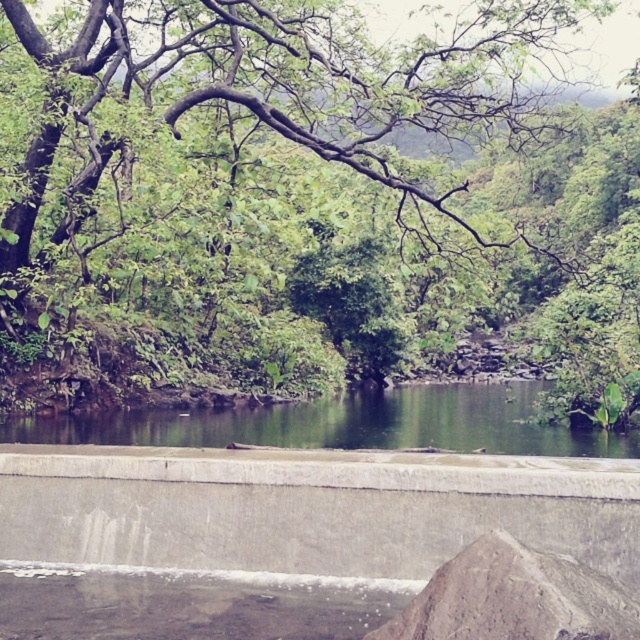
Does gray concrete at center appear under green smooth water at center?

No.

Does gray concrete at center appear on the right side of green smooth water at center?

Incorrect, gray concrete at center is not on the right side of green smooth water at center.

Where is `gray concrete at center`? gray concrete at center is located at coordinates (308, 508).

Image resolution: width=640 pixels, height=640 pixels. Find the location of `gray concrete at center`. gray concrete at center is located at coordinates (308, 508).

Is green leafy tree at upper center positioned before green smooth water at center?

Yes.

This screenshot has height=640, width=640. Find the location of `green leafy tree at upper center`. green leafy tree at upper center is located at coordinates (253, 184).

Who is more distant from viewer, (262, 145) or (100, 417)?

The point (262, 145) is more distant.

This screenshot has height=640, width=640. Find the location of `green leafy tree at upper center`. green leafy tree at upper center is located at coordinates (253, 184).

Does green leafy tree at upper center have a smaller size compared to gray concrete at center?

No, green leafy tree at upper center is not smaller than gray concrete at center.

At what (x,y) coordinates should I click in order to perform the action: click on green leafy tree at upper center. Please return your answer as a coordinate pair (x, y). The height and width of the screenshot is (640, 640). Looking at the image, I should click on (253, 184).